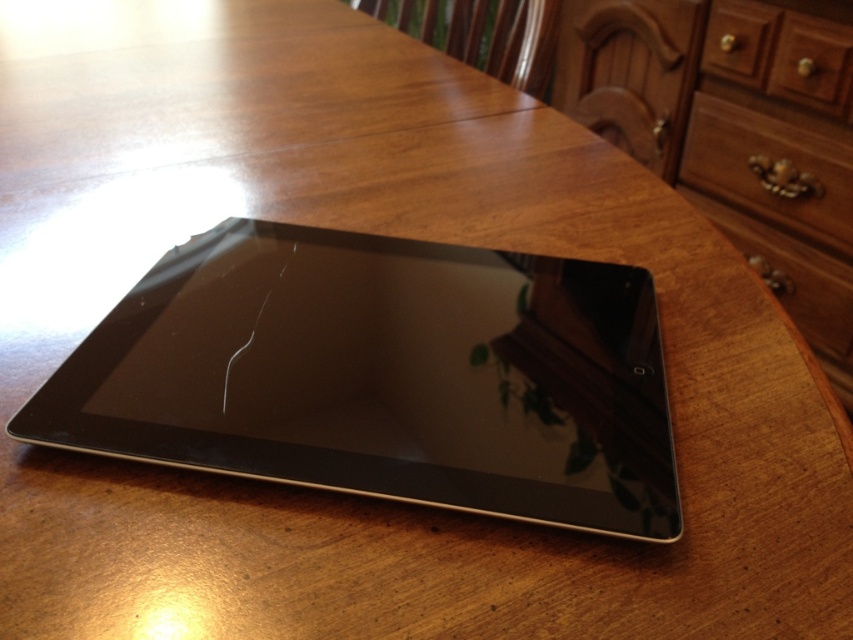
Does brown wooden drawer at upper right appear under wooden drawer at center?

Incorrect, brown wooden drawer at upper right is not positioned below wooden drawer at center.

Who is more forward, (793, 208) or (827, 285)?

Positioned in front is point (827, 285).

Describe the element at coordinates (770, 170) in the screenshot. The height and width of the screenshot is (640, 853). I see `brown wooden drawer at upper right` at that location.

Find the location of a particular element. The image size is (853, 640). brown wooden drawer at upper right is located at coordinates [770, 170].

Consider the image. Is brown wood drawer at upper right thinner than wooden drawer at center?

Yes, brown wood drawer at upper right is thinner than wooden drawer at center.

Does brown wood drawer at upper right come in front of wooden drawer at center?

That is True.

Describe the element at coordinates (781, 54) in the screenshot. This screenshot has height=640, width=853. I see `brown wood drawer at upper right` at that location.

At what (x,y) coordinates should I click in order to perform the action: click on brown wood drawer at upper right. Please return your answer as a coordinate pair (x, y). The image size is (853, 640). Looking at the image, I should click on (781, 54).

What do you see at coordinates (383, 376) in the screenshot? The width and height of the screenshot is (853, 640). I see `black glossy tablet at center` at bounding box center [383, 376].

Who is higher up, black glossy tablet at center or brown wooden drawer at upper right?

Positioned higher is brown wooden drawer at upper right.

Image resolution: width=853 pixels, height=640 pixels. What do you see at coordinates (383, 376) in the screenshot?
I see `black glossy tablet at center` at bounding box center [383, 376].

Identify the location of black glossy tablet at center. The height and width of the screenshot is (640, 853). (383, 376).